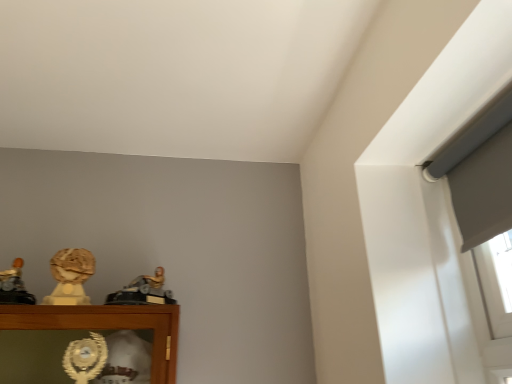
Question: Does gold metallic figure at center, which appears as the first character sculpture when viewed from the right, have a larger size compared to matte gold bust at left, the second character sculpture positioned from the right?

Choices:
 (A) yes
 (B) no

Answer: (A)

Question: Does gold metallic figure at center, arranged as the 3th character sculpture when viewed from the left, have a greater width compared to matte gold bust at left, which appears as the 2th character sculpture when viewed from the left?

Choices:
 (A) yes
 (B) no

Answer: (A)

Question: Does gold metallic figure at center, arranged as the 3th character sculpture when viewed from the left, have a lesser height compared to matte gold bust at left, the second character sculpture positioned from the right?

Choices:
 (A) yes
 (B) no

Answer: (A)

Question: Is gold metallic figure at center, arranged as the 3th character sculpture when viewed from the left, to the right of matte gold bust at left, the second character sculpture positioned from the right, from the viewer's perspective?

Choices:
 (A) yes
 (B) no

Answer: (A)

Question: Is gold metallic figure at center, arranged as the 3th character sculpture when viewed from the left, outside matte gold bust at left, which appears as the 2th character sculpture when viewed from the left?

Choices:
 (A) yes
 (B) no

Answer: (A)

Question: Is matte gold bust at left, which appears as the 2th character sculpture when viewed from the left, inside or outside of gold metallic figure at center, which appears as the first character sculpture when viewed from the right?

Choices:
 (A) outside
 (B) inside

Answer: (A)

Question: Is matte gold bust at left, the second character sculpture positioned from the right, taller or shorter than gold metallic figure at center, arranged as the 3th character sculpture when viewed from the left?

Choices:
 (A) tall
 (B) short

Answer: (A)

Question: From the image's perspective, is matte gold bust at left, which appears as the 2th character sculpture when viewed from the left, above or below gold metallic figure at center, which appears as the first character sculpture when viewed from the right?

Choices:
 (A) above
 (B) below

Answer: (A)

Question: In the image, is matte gold bust at left, which appears as the 2th character sculpture when viewed from the left, positioned in front of or behind gold metallic figure at center, which appears as the first character sculpture when viewed from the right?

Choices:
 (A) behind
 (B) front

Answer: (A)

Question: Visually, is matte gold bust at left, which appears as the 2th character sculpture when viewed from the left, positioned to the left or to the right of matte gold statue at left, the 1th character sculpture viewed from the left?

Choices:
 (A) left
 (B) right

Answer: (B)

Question: Looking at the image, does matte gold bust at left, which appears as the 2th character sculpture when viewed from the left, seem bigger or smaller compared to matte gold statue at left, the 3th character sculpture from the right?

Choices:
 (A) big
 (B) small

Answer: (B)

Question: Considering their positions, is matte gold bust at left, which appears as the 2th character sculpture when viewed from the left, located in front of or behind matte gold statue at left, the 1th character sculpture viewed from the left?

Choices:
 (A) behind
 (B) front

Answer: (A)

Question: Considering the positions of matte gold bust at left, which appears as the 2th character sculpture when viewed from the left, and matte gold statue at left, the 1th character sculpture viewed from the left, in the image, is matte gold bust at left, which appears as the 2th character sculpture when viewed from the left, taller or shorter than matte gold statue at left, the 1th character sculpture viewed from the left,?

Choices:
 (A) tall
 (B) short

Answer: (A)

Question: Is matte gold statue at left, the 1th character sculpture viewed from the left, situated inside matte gold bust at left, which appears as the 2th character sculpture when viewed from the left, or outside?

Choices:
 (A) inside
 (B) outside

Answer: (B)

Question: From the image's perspective, is matte gold statue at left, the 1th character sculpture viewed from the left, positioned above or below matte gold bust at left, which appears as the 2th character sculpture when viewed from the left?

Choices:
 (A) above
 (B) below

Answer: (B)